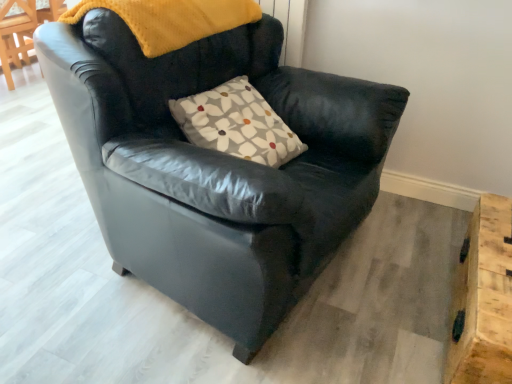
Question: From the image's perspective, would you say black leather armchair at center is shown under floral-patterned fabric pillow at center?

Choices:
 (A) no
 (B) yes

Answer: (B)

Question: Considering the relative positions of black leather armchair at center and floral-patterned fabric pillow at center in the image provided, is black leather armchair at center to the left of floral-patterned fabric pillow at center from the viewer's perspective?

Choices:
 (A) yes
 (B) no

Answer: (A)

Question: Is black leather armchair at center closer to camera compared to floral-patterned fabric pillow at center?

Choices:
 (A) yes
 (B) no

Answer: (A)

Question: Does black leather armchair at center have a lesser width compared to floral-patterned fabric pillow at center?

Choices:
 (A) no
 (B) yes

Answer: (A)

Question: Is there a large distance between black leather armchair at center and floral-patterned fabric pillow at center?

Choices:
 (A) no
 (B) yes

Answer: (A)

Question: Considering the relative positions of wooden at lower right and black leather armchair at center in the image provided, is wooden at lower right to the left or to the right of black leather armchair at center?

Choices:
 (A) right
 (B) left

Answer: (A)

Question: Considering their positions, is wooden at lower right located in front of or behind black leather armchair at center?

Choices:
 (A) front
 (B) behind

Answer: (B)

Question: Would you say wooden at lower right is inside or outside black leather armchair at center?

Choices:
 (A) outside
 (B) inside

Answer: (A)

Question: Is wooden at lower right wider or thinner than black leather armchair at center?

Choices:
 (A) thin
 (B) wide

Answer: (A)

Question: From the image's perspective, relative to black leather armchair at center, is floral-patterned fabric pillow at center above or below?

Choices:
 (A) below
 (B) above

Answer: (B)

Question: Considering the positions of point (246, 119) and point (228, 51), is point (246, 119) closer or farther from the camera than point (228, 51)?

Choices:
 (A) closer
 (B) farther

Answer: (A)

Question: In terms of size, does floral-patterned fabric pillow at center appear bigger or smaller than black leather armchair at center?

Choices:
 (A) big
 (B) small

Answer: (B)

Question: In the image, is floral-patterned fabric pillow at center on the left side or the right side of black leather armchair at center?

Choices:
 (A) right
 (B) left

Answer: (A)

Question: Relative to wooden at lower right, is black leather armchair at center in front or behind?

Choices:
 (A) front
 (B) behind

Answer: (A)

Question: In terms of size, does black leather armchair at center appear bigger or smaller than wooden at lower right?

Choices:
 (A) big
 (B) small

Answer: (A)